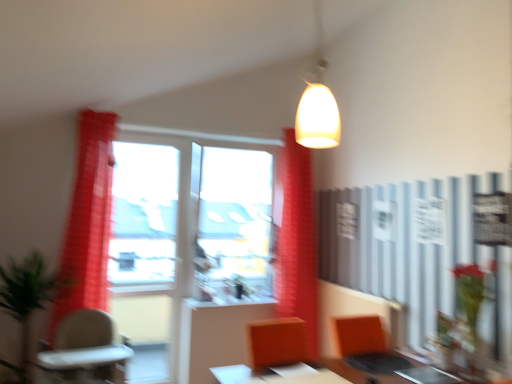
This screenshot has height=384, width=512. I want to click on unoccupied space behind green matte plant at center, which is the first plant in back-to-front order, so click(x=241, y=292).